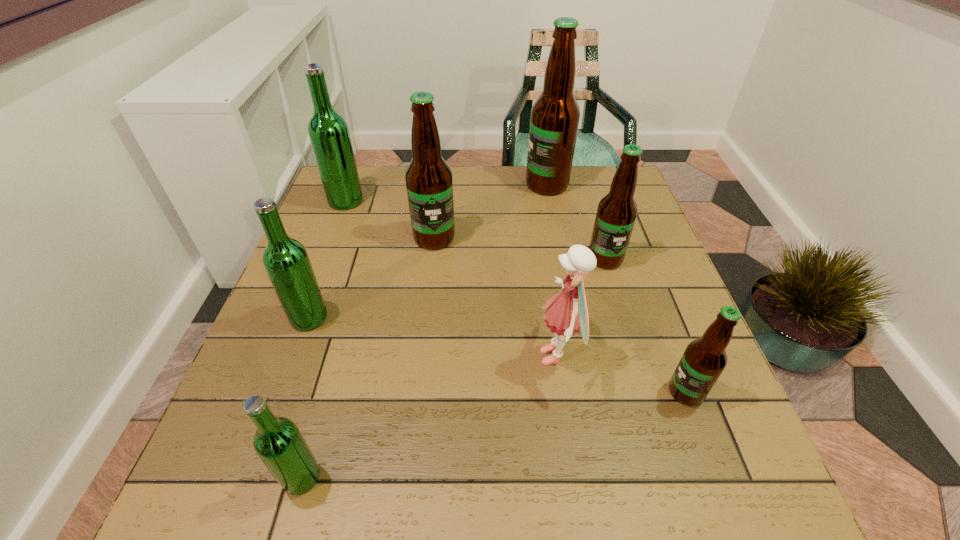
Where is `vacant region located on the front-facing side of the doll`? The width and height of the screenshot is (960, 540). vacant region located on the front-facing side of the doll is located at coordinates (476, 356).

I want to click on blank area located 0.300m on the front-facing side of the doll, so 386,356.

Find the location of a particular element. The height and width of the screenshot is (540, 960). free point located on the front-facing side of the doll is located at coordinates (351, 356).

You are a GUI agent. You are given a task and a screenshot of the screen. Output one action in this format:
    pyautogui.click(x=<x>, y=<y>)
    Task: Click on the free region located on the label of the smallest brown beer bottle
    The image size is (960, 540).
    Given the screenshot: What is the action you would take?
    pyautogui.click(x=454, y=392)

Identify the location of vacant space located on the label of the smallest brown beer bottle. The width and height of the screenshot is (960, 540). (535, 392).

Locate an element on the screen. vacant region located 0.320m on the label of the smallest brown beer bottle is located at coordinates (497, 392).

Where is `blank space located on the right of the third beer bottle from left to right`? The image size is (960, 540). blank space located on the right of the third beer bottle from left to right is located at coordinates (506, 477).

The image size is (960, 540). I want to click on object at the near edge, so click(x=278, y=442).

Image resolution: width=960 pixels, height=540 pixels. Identify the location of object that is at the far left corner. (328, 131).

This screenshot has width=960, height=540. Find the location of `object present at the near left corner`. object present at the near left corner is located at coordinates (278, 442).